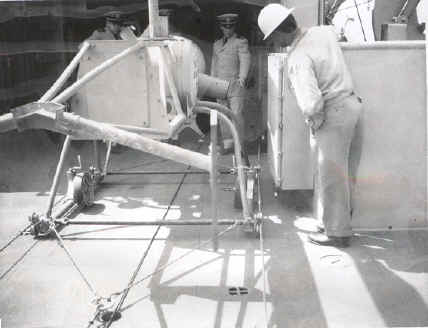
At what (x,y) coordinates should I click in order to perform the action: click on floor. Please return your answer as a coordinate pair (x, y). Looking at the image, I should click on (301, 281).